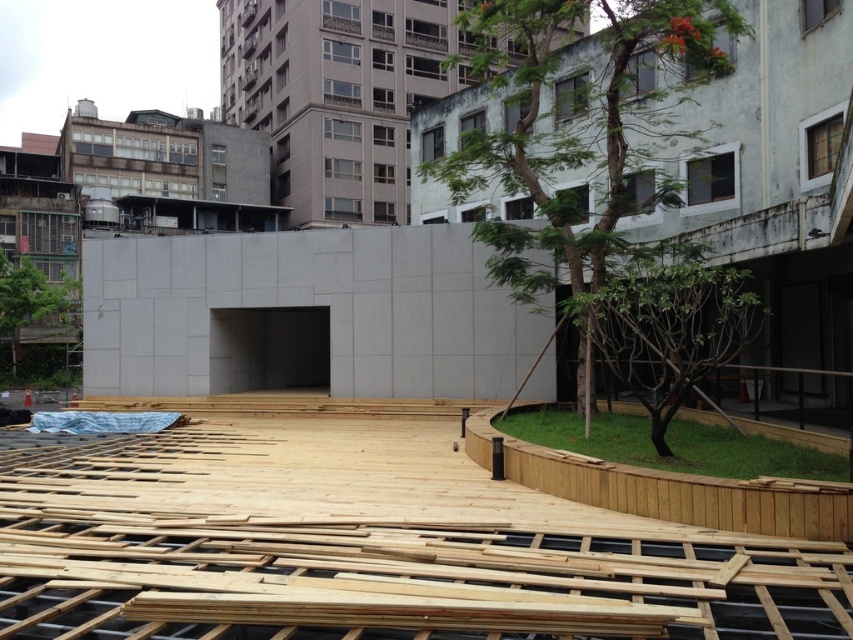
Can you confirm if green leafy tree at center is smaller than green leafy tree at center-right?

Incorrect, green leafy tree at center is not smaller in size than green leafy tree at center-right.

From the picture: Who is more forward, (612, 93) or (668, 378)?

Positioned in front is point (668, 378).

Does point (602, 243) lie behind point (682, 321)?

Yes, point (602, 243) is farther from viewer.

I want to click on green leafy tree at center, so click(575, 134).

Looking at this image, is natural wood planks at center wider than green leafy tree at center?

Indeed, natural wood planks at center has a greater width compared to green leafy tree at center.

Is natural wood planks at center closer to camera compared to green leafy tree at center?

Yes, natural wood planks at center is in front of green leafy tree at center.

Is point (656, 534) positioned before point (572, 13)?

Yes, it is in front of point (572, 13).

You are a GUI agent. You are given a task and a screenshot of the screen. Output one action in this format:
    pyautogui.click(x=<x>, y=<y>)
    Task: Click on the natural wood planks at center
    
    Given the screenshot: What is the action you would take?
    pyautogui.click(x=364, y=540)

Who is positioned more to the left, natural wood planks at center or green leafy tree at center-right?

From the viewer's perspective, natural wood planks at center appears more on the left side.

Based on the photo, which of these two, natural wood planks at center or green leafy tree at center-right, stands taller?

With more height is natural wood planks at center.

Measure the distance between point [579,556] and camera.

Point [579,556] is 5.69 meters from camera.

This screenshot has height=640, width=853. I want to click on natural wood planks at center, so click(x=364, y=540).